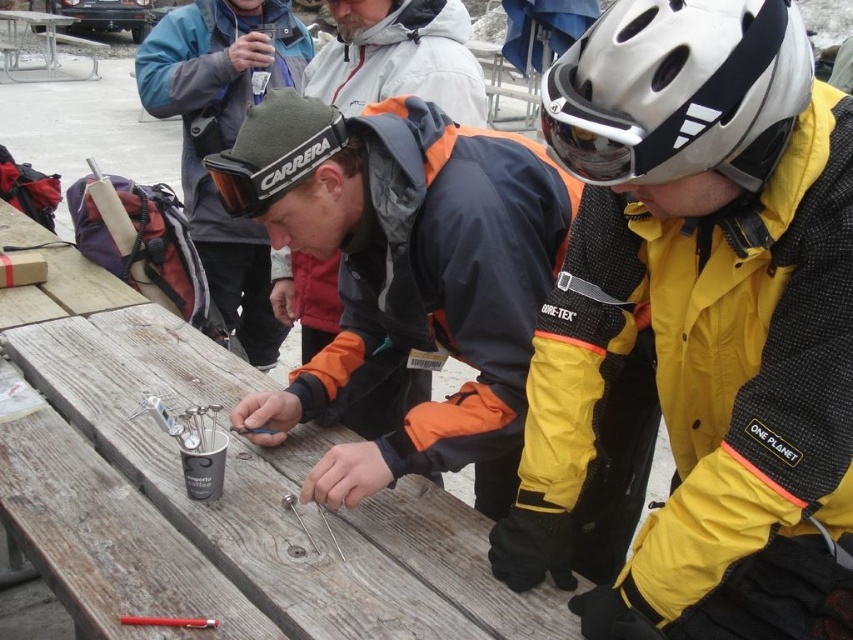
Can you confirm if orange and black jacket at center is smaller than orange ski goggles at center?

Actually, orange and black jacket at center might be larger than orange ski goggles at center.

Is point (432, 451) closer to viewer compared to point (138, 84)?

Yes, it is in front of point (138, 84).

This screenshot has height=640, width=853. Identify the location of orange and black jacket at center. (419, 266).

Does white matte bicycle helmet at upper center appear over orange ski goggles at center?

No.

Between white matte bicycle helmet at upper center and orange ski goggles at center, which one appears on the right side from the viewer's perspective?

white matte bicycle helmet at upper center is more to the right.

Does point (672, 90) come behind point (241, 328)?

No.

Locate an element on the screen. white matte bicycle helmet at upper center is located at coordinates (677, 92).

Does orange and black jacket at center have a greater height compared to white matte bicycle helmet at upper center?

Indeed, orange and black jacket at center has a greater height compared to white matte bicycle helmet at upper center.

Between orange and black jacket at center and white matte bicycle helmet at upper center, which one is positioned lower?

orange and black jacket at center

The image size is (853, 640). Find the location of `orange and black jacket at center`. orange and black jacket at center is located at coordinates (419, 266).